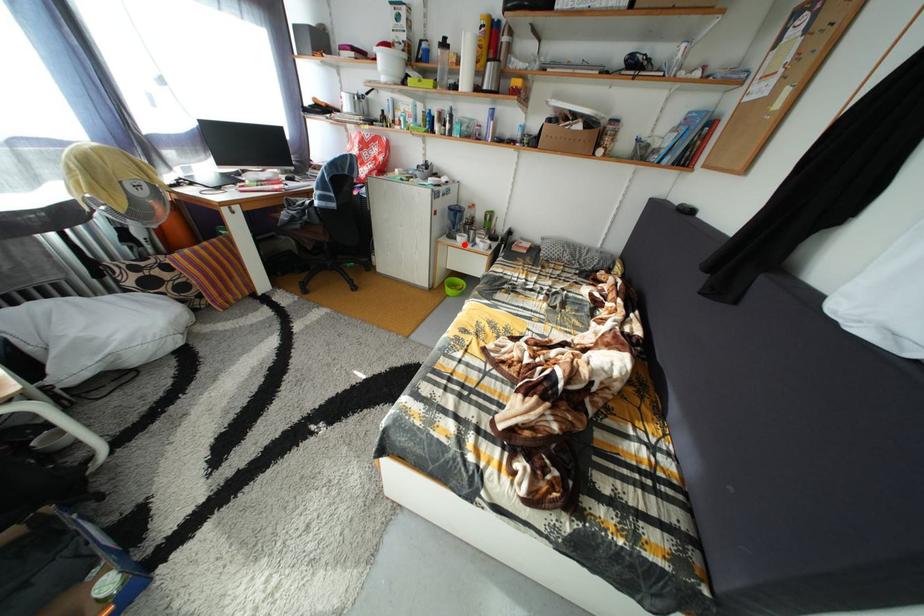
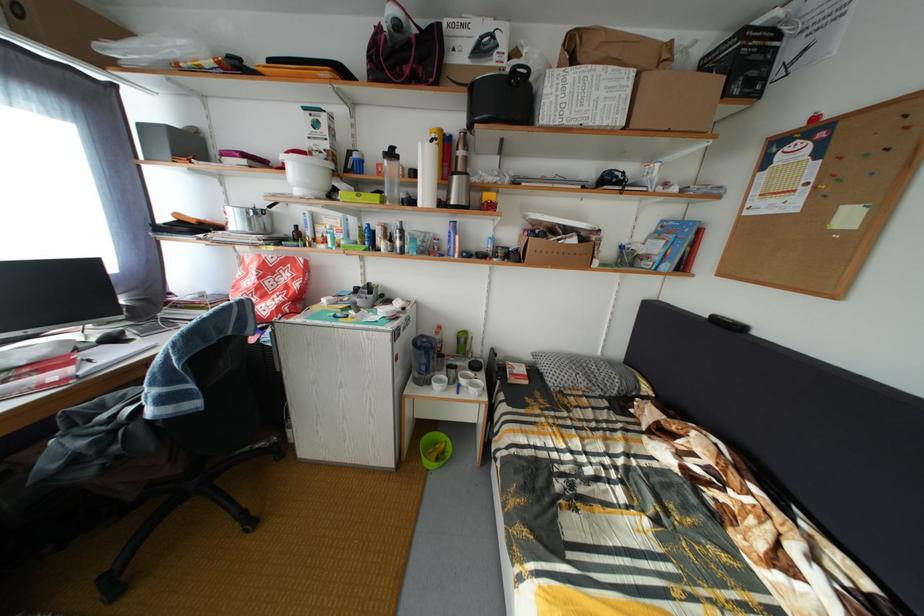
Question: I am providing you with two images of the same scene from different viewpoints. Image1 has a red point marked. In image2, the corresponding 3D location appears at what relative position? Reply with the corresponding letter.

Choices:
 (A) Closer
 (B) Farther

Answer: (B)